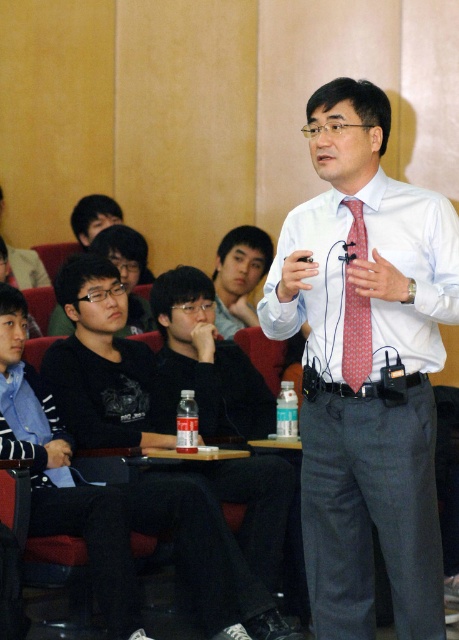
Question: Which of the following is the closest to the observer?

Choices:
 (A) (408, 356)
 (B) (304, 522)
 (C) (362, 384)
 (D) (70, 412)

Answer: (A)

Question: In this image, where is white shirt at center located relative to red dotted tie at center?

Choices:
 (A) above
 (B) below

Answer: (B)

Question: Considering the relative positions of black shirt at left and white smooth shirt at center in the image provided, where is black shirt at left located with respect to white smooth shirt at center?

Choices:
 (A) right
 (B) left

Answer: (B)

Question: Which object is closer to the camera taking this photo?

Choices:
 (A) red dotted tie at center
 (B) black shirt at left

Answer: (A)

Question: Does white shirt at center appear on the left side of black shirt at left?

Choices:
 (A) yes
 (B) no

Answer: (B)

Question: Which point is closer to the camera taking this photo?

Choices:
 (A) (418, 266)
 (B) (220, 328)
 (C) (436, 352)
 (D) (369, 324)

Answer: (A)